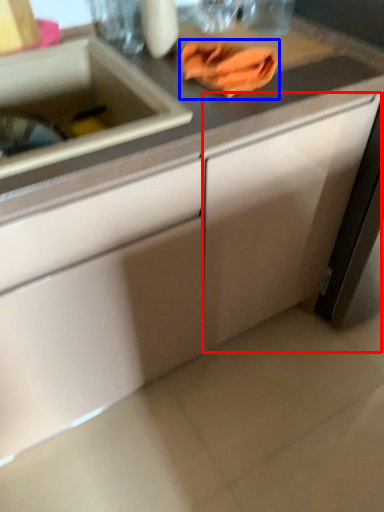
Question: Which object appears closest to the camera in this image, cabinetry (highlighted by a red box) or hand towel (highlighted by a blue box)?

Choices:
 (A) cabinetry
 (B) hand towel

Answer: (A)